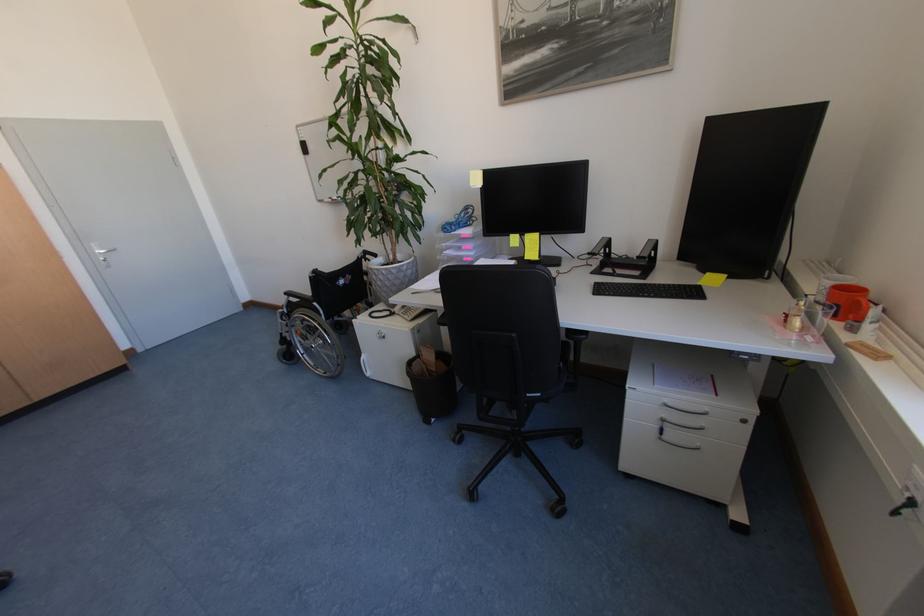
The width and height of the screenshot is (924, 616). What do you see at coordinates (744, 419) in the screenshot?
I see `the cabinet lock` at bounding box center [744, 419].